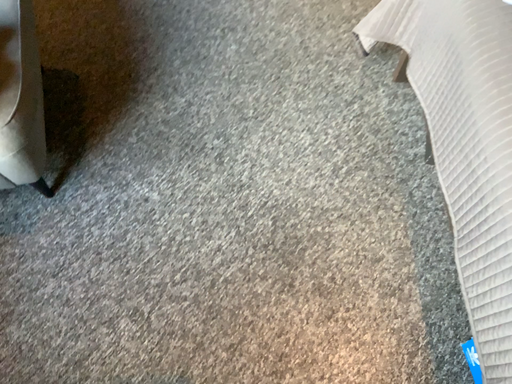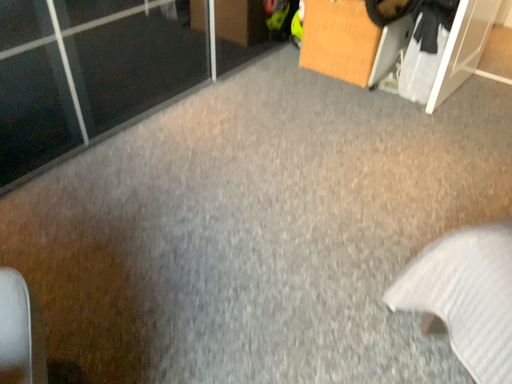
Question: How did the camera likely rotate when shooting the video?

Choices:
 (A) rotated downward
 (B) rotated upward

Answer: (B)